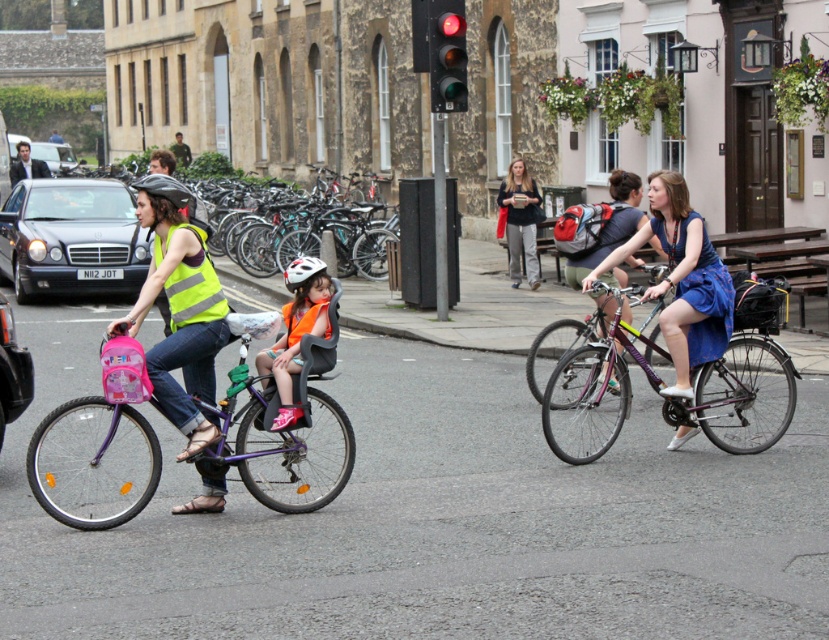
You are a tourist in this European town and see the purple matte bicycle at left and the shiny black helmet at left. Which object is positioned more to the right?

The purple matte bicycle at left is positioned more to the right than the shiny black helmet at left.

You are a delivery person who needs to find the purple matte bicycle at left. The GPS shows a point at coordinates (93,461). Is this point on the purple matte bicycle at left?

Yes, the point at (93,461) is on the purple matte bicycle at left according to the GPS.

You are standing at the point with coordinates point (653, 236) and want to walk towards the point with coordinates point (568, 362). Which direction should you move in to get closer to your destination?

Since point (568, 362) is closer to the viewer than point (653, 236), you should move forward towards the direction of the destination point.